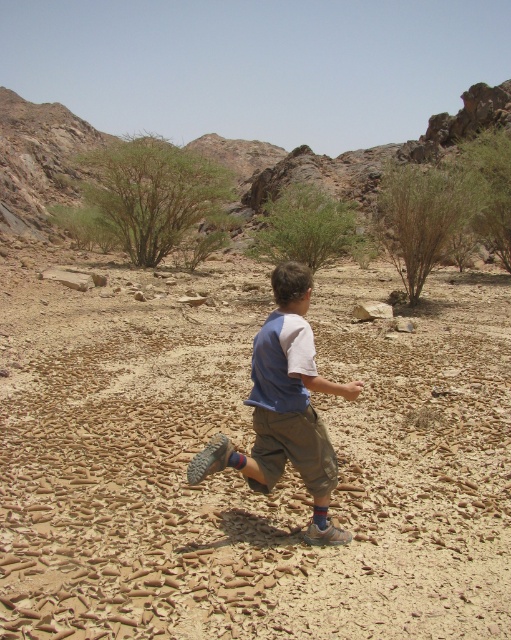
Based on the photo, you are a hiker navigating a dry, rocky landscape and need to cross the cracked, dry earth. The point you must reach is at coordinates point (247, 451). According to the image, what is located at that point?

At point (247, 451) lies brown cracked sand at center.